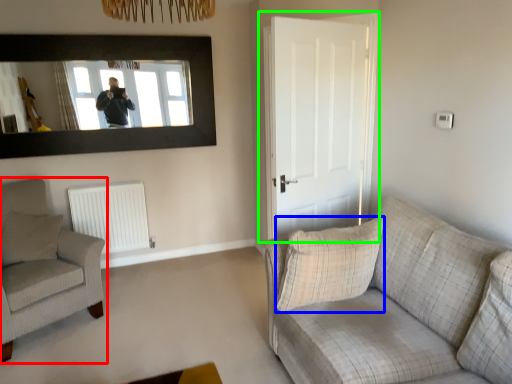
Question: Which object is the closest to the chair (highlighted by a red box)? Choose among these: pillow (highlighted by a blue box) or door (highlighted by a green box).

Choices:
 (A) pillow
 (B) door

Answer: (A)